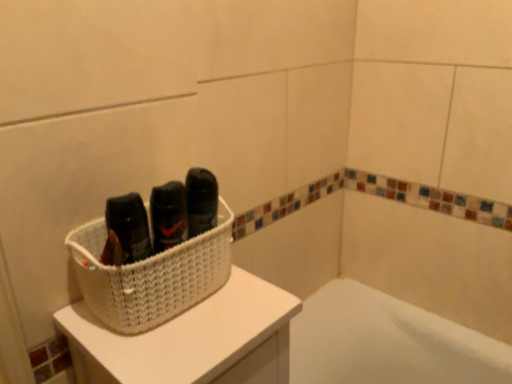
Find the location of a particular element. This screenshot has width=512, height=384. white woven basket at upper left is located at coordinates (150, 275).

Image resolution: width=512 pixels, height=384 pixels. Describe the element at coordinates (150, 275) in the screenshot. I see `white woven basket at upper left` at that location.

Locate an element on the screen. The image size is (512, 384). white woven basket at upper left is located at coordinates (191, 340).

Describe the element at coordinates (191, 340) in the screenshot. I see `white woven basket at upper left` at that location.

Find the location of a particular element. The image size is (512, 384). white woven basket at upper left is located at coordinates (150, 275).

Is white woven basket at upper left at the left side of white woven basket at upper left?

Yes.

Considering the relative positions of white woven basket at upper left and white woven basket at upper left in the image provided, is white woven basket at upper left in front of white woven basket at upper left?

No, white woven basket at upper left is further to the viewer.

Is point (104, 304) farther from camera compared to point (276, 351)?

No.

From the image's perspective, does white woven basket at upper left appear lower than white woven basket at upper left?

No.

From a real-world perspective, is white woven basket at upper left below white woven basket at upper left?

Actually, white woven basket at upper left is physically above white woven basket at upper left in the real world.

Can you confirm if white woven basket at upper left is wider than white woven basket at upper left?

Incorrect, the width of white woven basket at upper left does not surpass that of white woven basket at upper left.

Can you confirm if white woven basket at upper left is shorter than white woven basket at upper left?

Yes.

Is white woven basket at upper left bigger than white woven basket at upper left?

No, white woven basket at upper left is not bigger than white woven basket at upper left.

Would you say white woven basket at upper left is inside or outside white woven basket at upper left?

white woven basket at upper left is outside white woven basket at upper left.

Is white woven basket at upper left positioned far away from white woven basket at upper left?

They are positioned close to each other.

Is white woven basket at upper left facing towards white woven basket at upper left?

No, white woven basket at upper left is not oriented towards white woven basket at upper left.

What's the angular difference between white woven basket at upper left and white woven basket at upper left's facing directions?

They differ by 0.921 degrees in their facing directions.

Locate an element on the screen. furniture located on the right of white woven basket at upper left is located at coordinates (191, 340).

Which object is positioned more to the left, white woven basket at upper left or white woven basket at upper left?

white woven basket at upper left.

Is the position of white woven basket at upper left less distant than that of white woven basket at upper left?

Yes, it is.

Is point (211, 381) closer or farther from the camera than point (80, 266)?

Point (211, 381) is closer to the camera than point (80, 266).

From the image's perspective, is white woven basket at upper left located above white woven basket at upper left?

No, from the image's perspective, white woven basket at upper left is not above white woven basket at upper left.

From a real-world perspective, is white woven basket at upper left beneath white woven basket at upper left?

Indeed, from a real-world perspective, white woven basket at upper left is positioned beneath white woven basket at upper left.

Is white woven basket at upper left wider than white woven basket at upper left?

Yes, white woven basket at upper left is wider than white woven basket at upper left.

In terms of height, does white woven basket at upper left look taller or shorter compared to white woven basket at upper left?

white woven basket at upper left is taller than white woven basket at upper left.

Does white woven basket at upper left have a smaller size compared to white woven basket at upper left?

Actually, white woven basket at upper left might be larger than white woven basket at upper left.

Is white woven basket at upper left spatially inside white woven basket at upper left, or outside of it?

white woven basket at upper left is located beyond the bounds of white woven basket at upper left.

Is white woven basket at upper left far from white woven basket at upper left?

No, white woven basket at upper left is not far from white woven basket at upper left.

Could you tell me if white woven basket at upper left is turned towards white woven basket at upper left?

No, white woven basket at upper left is not aimed at white woven basket at upper left.

The width and height of the screenshot is (512, 384). In order to click on basket above the white woven basket at upper left (from the image's perspective) in this screenshot , I will do `click(150, 275)`.

I want to click on basket that appears behind the white woven basket at upper left, so click(x=150, y=275).

Where is `furniture lying in front of the white woven basket at upper left`? Image resolution: width=512 pixels, height=384 pixels. furniture lying in front of the white woven basket at upper left is located at coordinates (191, 340).